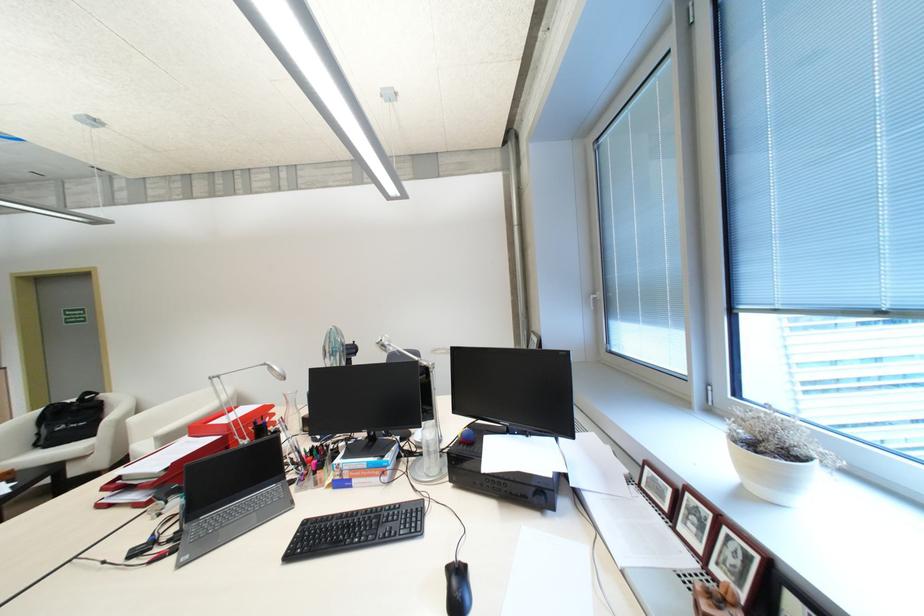
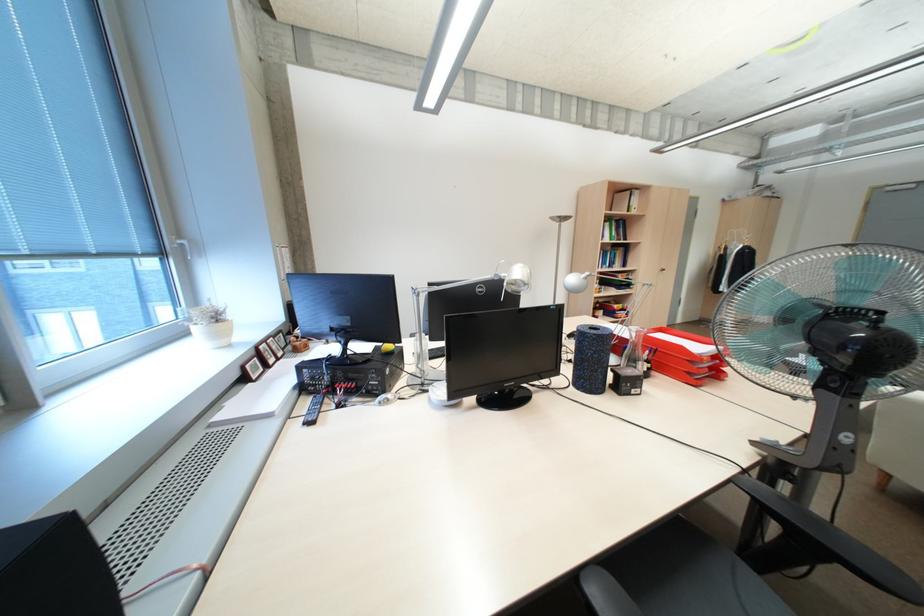
Question: I am providing you with two images of the same scene from different viewpoints. Please identify which objects are invisible in image2.

Choices:
 (A) chair sitting surface
 (B) white window handle
 (C) framed wall art
 (D) black computer mouse

Answer: (D)